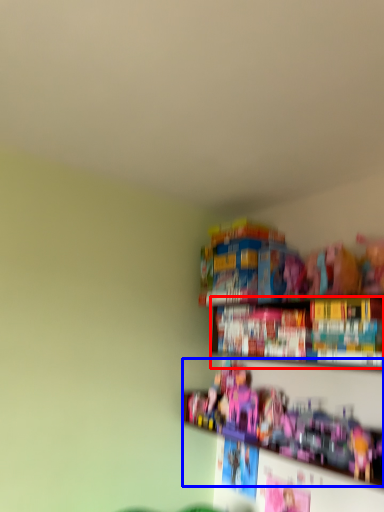
Question: Which object is closer to the camera taking this photo, book (highlighted by a red box) or toy (highlighted by a blue box)?

Choices:
 (A) book
 (B) toy

Answer: (B)